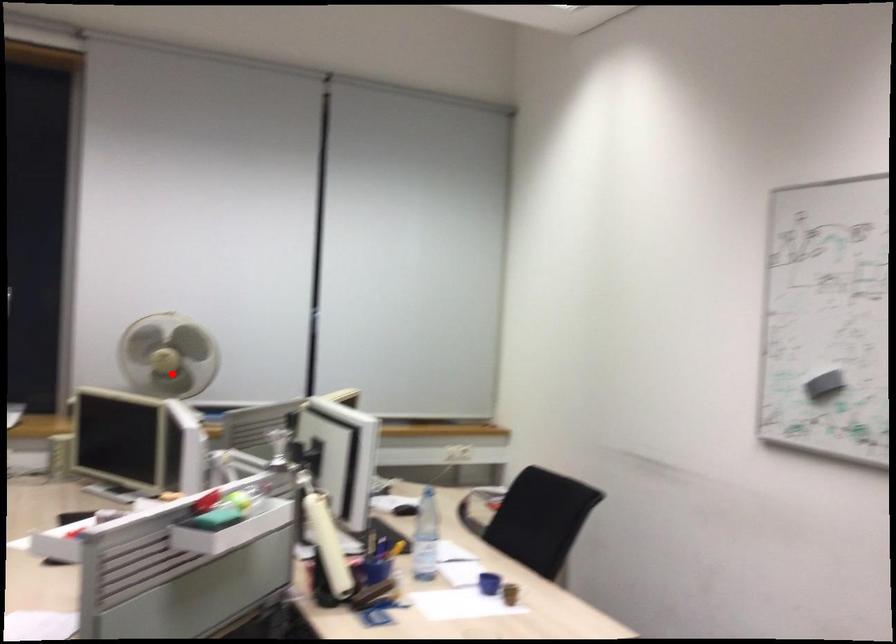
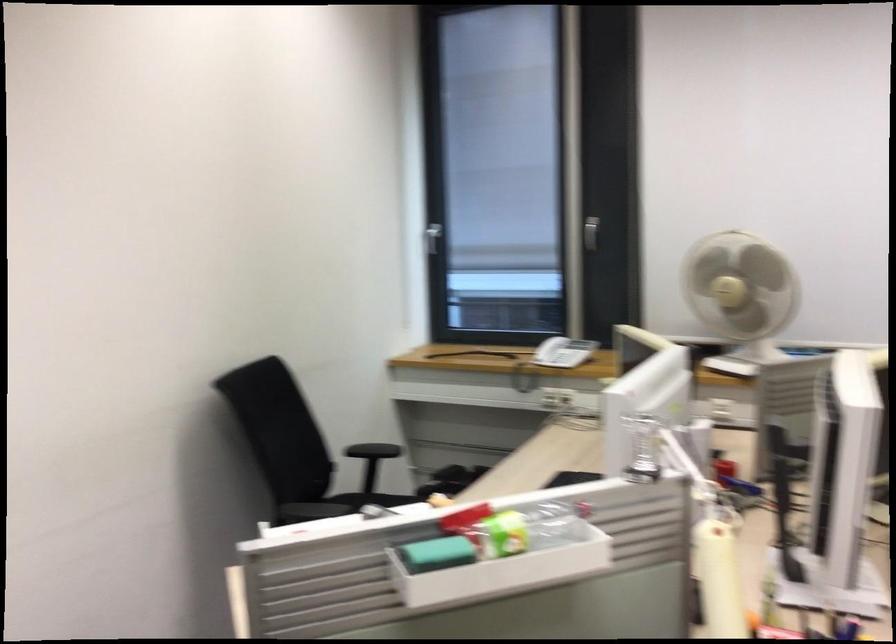
In the second image, find the point that corresponds to the highlighted location in the first image.

(741, 290)